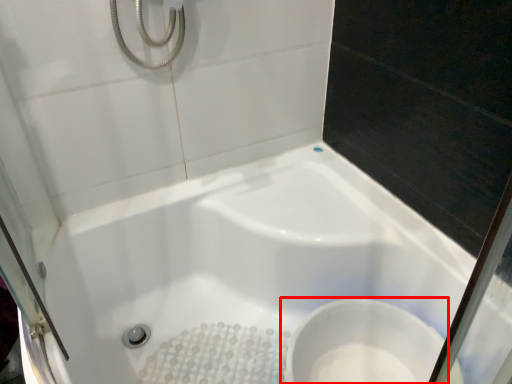
Question: Observing the image, what is the correct spatial positioning of toilet (annotated by the red box) in reference to bathtub?

Choices:
 (A) right
 (B) left

Answer: (A)